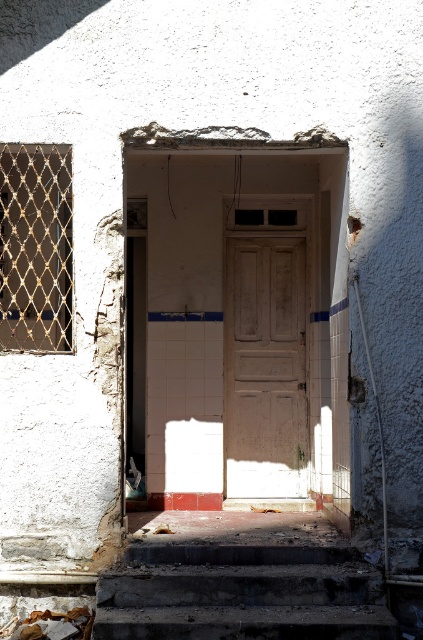
Question: Which object is the farthest from the dark concrete stairs at lower center?

Choices:
 (A) rusty metal debris at lower left
 (B) white matte door at center

Answer: (B)

Question: Among these objects, which one is farthest from the camera?

Choices:
 (A) white matte door at center
 (B) rusty metal debris at lower left
 (C) dark concrete stairs at lower center

Answer: (A)

Question: Is dark concrete stairs at lower center wider than rusty metal debris at lower left?

Choices:
 (A) no
 (B) yes

Answer: (B)

Question: Which of the following is the farthest from the observer?

Choices:
 (A) (231, 256)
 (B) (41, 628)
 (C) (224, 563)

Answer: (A)

Question: Is dark concrete stairs at lower center to the left of white matte door at center from the viewer's perspective?

Choices:
 (A) no
 (B) yes

Answer: (B)

Question: Considering the relative positions of dark concrete stairs at lower center and white matte door at center in the image provided, where is dark concrete stairs at lower center located with respect to white matte door at center?

Choices:
 (A) left
 (B) right

Answer: (A)